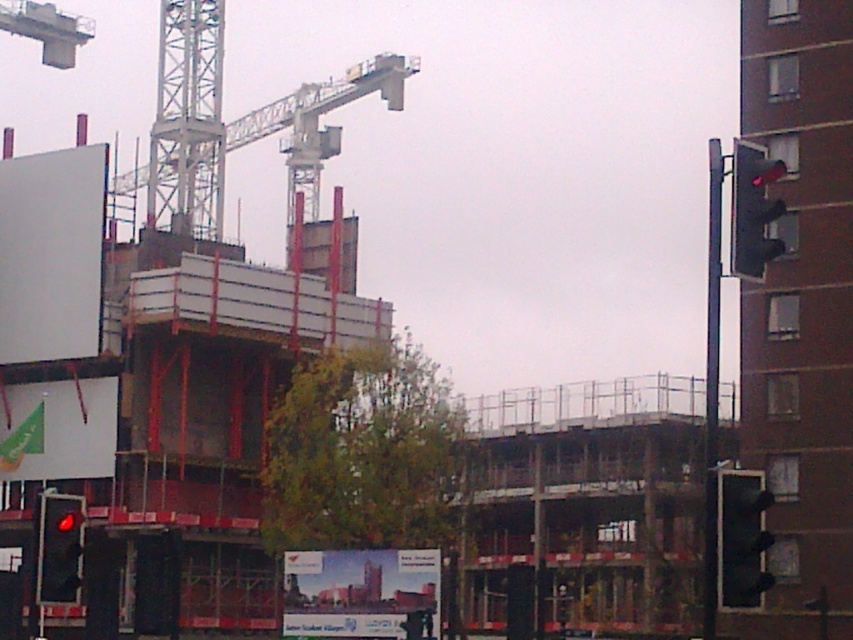
You are a delivery driver approaching the construction site. You notice two points marked on your map at coordinates point [28,225] and point [154,188]. Which point is closer to you as you drive towards the site?

Point [28,225] is in front of point [154,188], so it is closer to you as you approach the construction site.

You are a delivery driver approaching the construction site. You need to navigate around the metallic gray crane at upper center and the white matte billboard at upper left. Which object is closer to the ground?

The white matte billboard at upper left is positioned under the metallic gray crane at upper center, meaning it is closer to the ground.

You are a delivery driver approaching the construction site. You need to read the information on both the white matte billboard at upper left and the matte glass billboard at center. Which billboard will be easier to read from your current position?

The white matte billboard at upper left will be easier to read because it is positioned over the matte glass billboard at center, making it more visible from your current position.